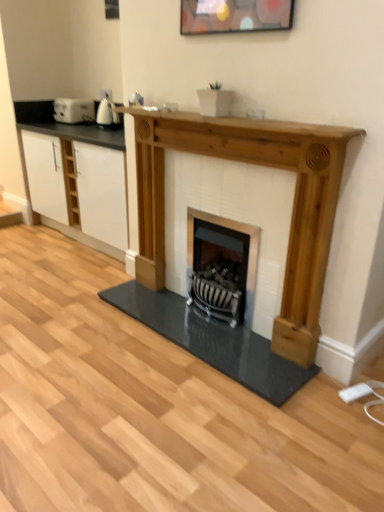
The width and height of the screenshot is (384, 512). Identify the location of free point to the left of natural wood fireplace at center. (82, 325).